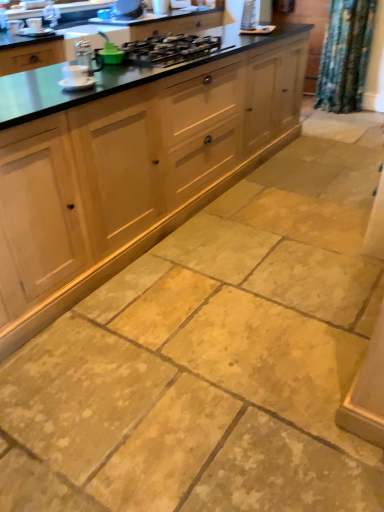
Where is `free space in front of white ceramic cup at upper left, the 5th appliance from the top`? free space in front of white ceramic cup at upper left, the 5th appliance from the top is located at coordinates pos(53,91).